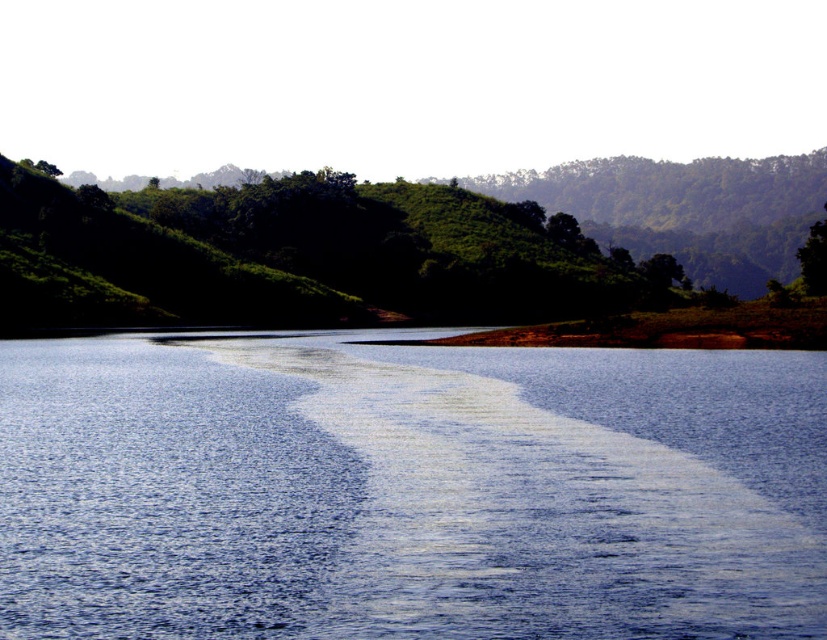
Based on the scene, which object takes up more area in the image? Please choose between the blue smooth water at center and the green leafy hillside at upper center.

The green leafy hillside at upper center occupies more space than the blue smooth water at center according to the description.

You are standing at the edge of the water and want to determine which object in the scene is taller. You see the green leafy hillside at upper center and the green leafy tree at upper right. Based on their positions, which one is taller?

The green leafy hillside at upper center is taller than the green leafy tree at upper right according to the description.

You are standing at the edge of the water in the image and want to reach the point marked by point [407,488]. Based on the scene description, what type of terrain will you encounter when you arrive there?

The point [407,488] marks blue smooth water at center, so arriving there would mean you are on the calm body of water described in the scene.